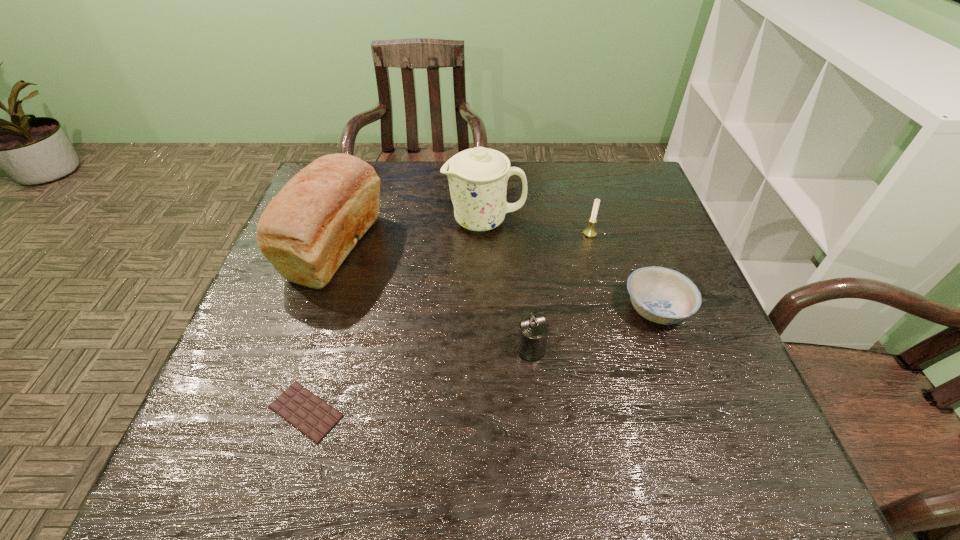
Find the location of a particular element. This screenshot has width=960, height=540. chinaware is located at coordinates point(477,177).

Image resolution: width=960 pixels, height=540 pixels. Identify the location of bread. point(308,229).

What are the coordinates of `the fifth object from left to right` in the screenshot? It's located at (591, 232).

In order to click on the second nearest object in this screenshot , I will do `click(533, 328)`.

In order to click on the second shortest object in this screenshot , I will do `click(661, 295)`.

This screenshot has width=960, height=540. In order to click on bowl in this screenshot , I will do `click(661, 295)`.

This screenshot has width=960, height=540. Find the location of `the nearest object`. the nearest object is located at coordinates (311, 415).

The width and height of the screenshot is (960, 540). I want to click on the shortest object, so click(x=311, y=415).

Where is `vacant space located on the spout of the chinaware`? Image resolution: width=960 pixels, height=540 pixels. vacant space located on the spout of the chinaware is located at coordinates (376, 221).

You are a GUI agent. You are given a task and a screenshot of the screen. Output one action in this format:
    pyautogui.click(x=<x>, y=<y>)
    Task: Click on the vacant space located on the spout of the chinaware
    The image size is (960, 540).
    Given the screenshot: What is the action you would take?
    pyautogui.click(x=383, y=221)